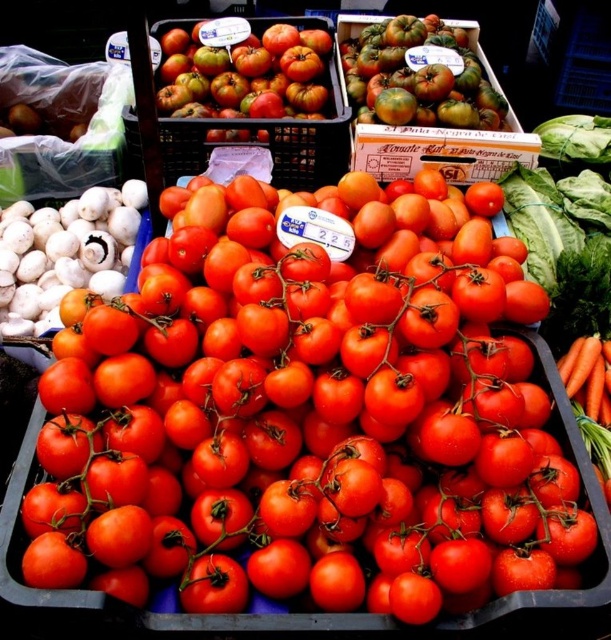
Looking at this image, you are a customer at the market stall and want to pick up both the shiny red tomatoes at center and the greenish matte tomatoes at upper center. What is the minimum distance you need to move between these two tomato varieties?

The minimum distance you need to move between the shiny red tomatoes at center and the greenish matte tomatoes at upper center is 24.67 inches.

You are a customer at the market stall and want to buy both the white matte garlic at left and the greenish matte tomatoes at upper center. If you first pick up the item that is higher up, which one will you pick first?

The greenish matte tomatoes at upper center are higher up than the white matte garlic at left, so you would pick them first.

You are standing at the market stall and want to locate two specific points. The first point is at coordinates point (97, 237) and the second is at point (354, 104). Which point is closer to you?

Point (97, 237) is in front of point (354, 104), so it is closer to you.